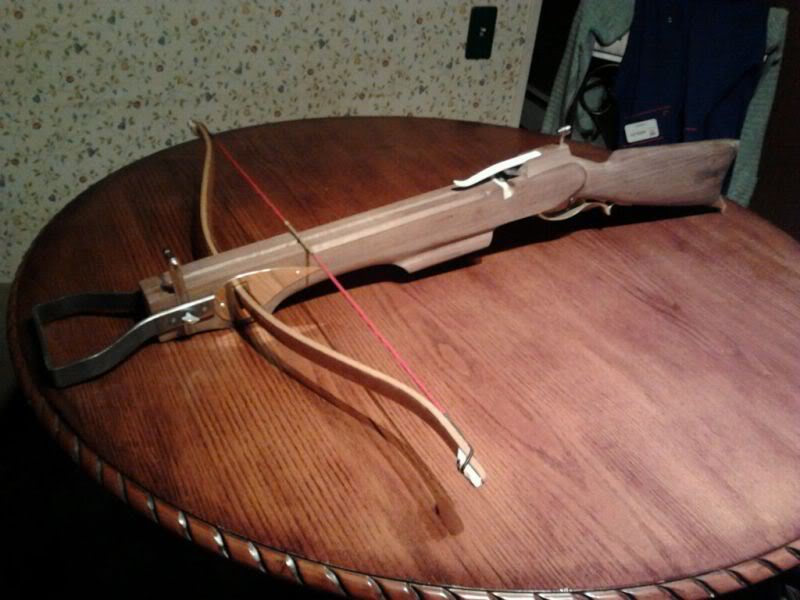
This screenshot has height=600, width=800. Identify the location of light switch. (482, 38).